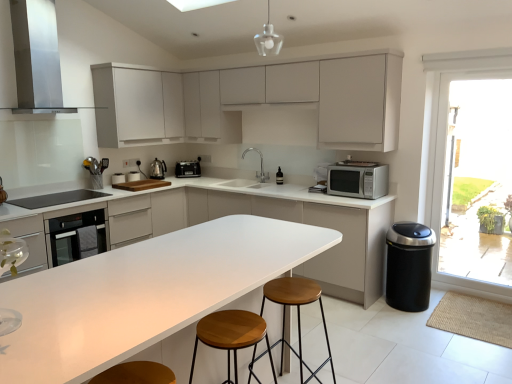
Question: Which direction should I rotate to look at wooden stool at center, the 1th stool from the front?

Choices:
 (A) left
 (B) right

Answer: (A)

Question: Considering the relative sizes of black glass cooktop at left and white matte cabinet at center, the third cabinetry when ordered from top to bottom, in the image provided, is black glass cooktop at left thinner than white matte cabinet at center, the third cabinetry when ordered from top to bottom,?

Choices:
 (A) yes
 (B) no

Answer: (A)

Question: Is black glass cooktop at left facing towards white matte cabinet at center, placed as the 1th cabinetry when sorted from bottom to top?

Choices:
 (A) yes
 (B) no

Answer: (B)

Question: Can you confirm if black glass cooktop at left is positioned to the right of white matte cabinet at center, placed as the 1th cabinetry when sorted from bottom to top?

Choices:
 (A) no
 (B) yes

Answer: (A)

Question: Is the depth of black glass cooktop at left less than that of white matte cabinet at center, the third cabinetry when ordered from top to bottom?

Choices:
 (A) yes
 (B) no

Answer: (B)

Question: Is black glass cooktop at left shorter than white matte cabinet at center, the third cabinetry when ordered from top to bottom?

Choices:
 (A) no
 (B) yes

Answer: (B)

Question: From the image's perspective, is black glass cooktop at left under white matte cabinet at center, placed as the 1th cabinetry when sorted from bottom to top?

Choices:
 (A) no
 (B) yes

Answer: (A)

Question: Is transparent glass door at right shorter than white laminate countertop at center?

Choices:
 (A) yes
 (B) no

Answer: (B)

Question: From a real-world perspective, is transparent glass door at right located beneath white laminate countertop at center?

Choices:
 (A) yes
 (B) no

Answer: (B)

Question: Can you confirm if transparent glass door at right is wider than white laminate countertop at center?

Choices:
 (A) no
 (B) yes

Answer: (A)

Question: From the image's perspective, does transparent glass door at right appear higher than white laminate countertop at center?

Choices:
 (A) yes
 (B) no

Answer: (A)

Question: Is transparent glass door at right not close to white laminate countertop at center?

Choices:
 (A) yes
 (B) no

Answer: (A)

Question: Is transparent glass door at right next to white laminate countertop at center and touching it?

Choices:
 (A) yes
 (B) no

Answer: (B)

Question: Considering the relative sizes of silver metallic faucet at center and transparent glass door at right in the image provided, is silver metallic faucet at center taller than transparent glass door at right?

Choices:
 (A) no
 (B) yes

Answer: (A)